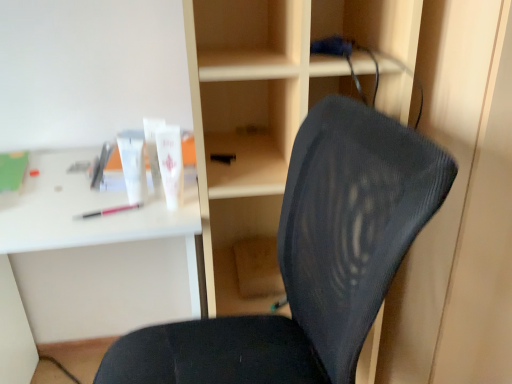
The width and height of the screenshot is (512, 384). Identify the location of free space to the back side of pink plastic pen at left. (112, 193).